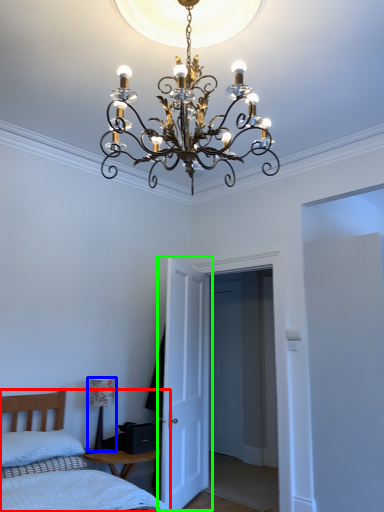
Question: Estimate the real-world distances between objects in this image. Which object is farther from bed (highlighted by a red box), lamp (highlighted by a blue box) or door (highlighted by a green box)?

Choices:
 (A) lamp
 (B) door

Answer: (B)